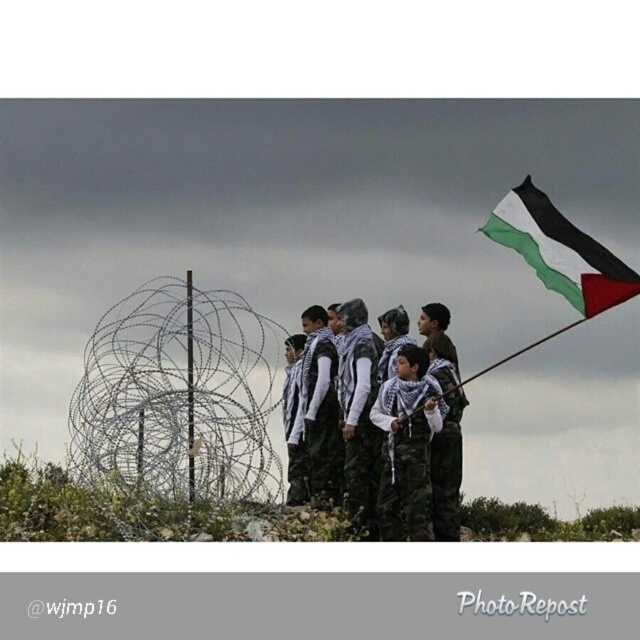
You are a photographer standing at the center of the scene. You want to take a photo that includes both the black and white fabric flag at upper right and the camouflage pants at center. Given that your camera has a maximum focus range of 5 meters, will both objects be in focus?

The black and white fabric flag at upper right and camouflage pants at center are 4.96 meters apart. Since the distance between them is within the camera maximum focus range of 5 meters, both objects will be in focus.

You are a photographer trying to capture a clear shot of the white matte uniform at center without the black and white fabric flag at upper right overlapping it. Based on their sizes, is this possible?

The black and white fabric flag at upper right might be wider than white matte uniform at center, so there is a possibility that the flag could overlap the uniform in the photo. Adjust your position to ensure the flag does not cover the uniform.